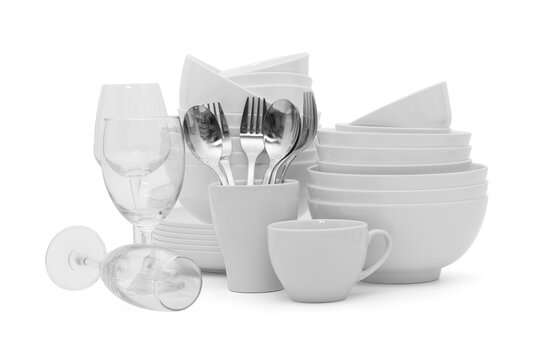
Locate an element on the screen. Image resolution: width=540 pixels, height=360 pixels. silverware is located at coordinates (308, 130), (276, 165), (281, 136), (254, 143), (226, 146), (211, 146).